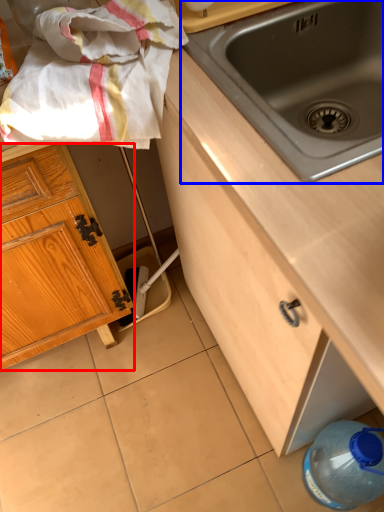
Question: Among these objects, which one is nearest to the camera, cabinetry (highlighted by a red box) or sink (highlighted by a blue box)?

Choices:
 (A) cabinetry
 (B) sink

Answer: (B)